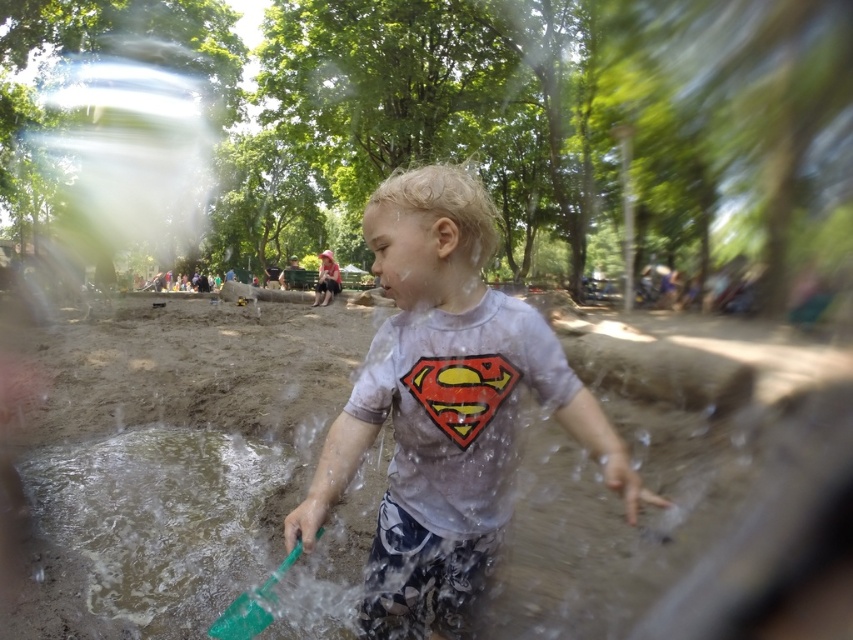
Question: Which point is closer to the camera?

Choices:
 (A) (422, 616)
 (B) (225, 611)

Answer: (B)

Question: Can you confirm if matte gray t-shirt at center is wider than green plastic shovel at center?

Choices:
 (A) no
 (B) yes

Answer: (B)

Question: Is matte gray t-shirt at center positioned in front of green plastic shovel at center?

Choices:
 (A) no
 (B) yes

Answer: (A)

Question: Is matte gray t-shirt at center above green plastic shovel at center?

Choices:
 (A) yes
 (B) no

Answer: (A)

Question: Which point is closer to the camera?

Choices:
 (A) (260, 612)
 (B) (440, 237)

Answer: (A)

Question: Which point appears closest to the camera in this image?

Choices:
 (A) (247, 620)
 (B) (581, 388)

Answer: (A)